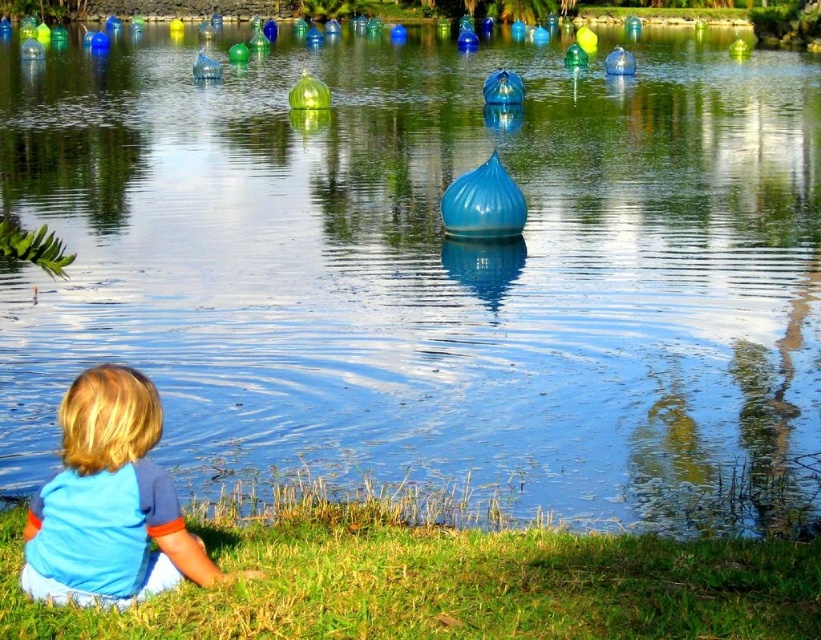
You are a photographer trying to capture the blue cotton shirt at lower left and the green grass at lower left in the same frame. Based on their positions, which one would appear closer to the camera?

The green grass at lower left is below the blue cotton shirt at lower left, so the blue cotton shirt at lower left would appear closer to the camera since it is positioned above the grass.